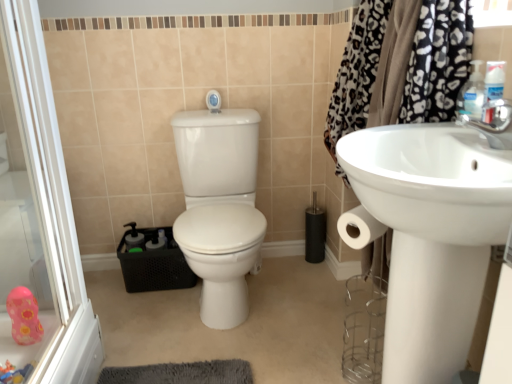
Where is `vacant space to the left of white glossy toilet at center`? The image size is (512, 384). vacant space to the left of white glossy toilet at center is located at coordinates (131, 311).